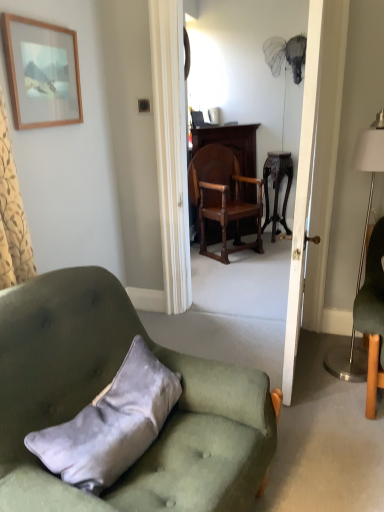
Question: Is white wooden door at center touching polished wood chair at center, which appears as the first chair when viewed from the top?

Choices:
 (A) yes
 (B) no

Answer: (B)

Question: Is white wooden door at center outside polished wood chair at center, the 1th chair viewed from the back?

Choices:
 (A) yes
 (B) no

Answer: (A)

Question: Considering the relative sizes of white wooden door at center and polished wood chair at center, the second chair when ordered from bottom to top, in the image provided, is white wooden door at center bigger than polished wood chair at center, the second chair when ordered from bottom to top,?

Choices:
 (A) yes
 (B) no

Answer: (B)

Question: Could you tell me if white wooden door at center is facing polished wood chair at center, which appears as the first chair when viewed from the top?

Choices:
 (A) yes
 (B) no

Answer: (B)

Question: From the image's perspective, is white wooden door at center above polished wood chair at center, acting as the 2th chair starting from the front?

Choices:
 (A) no
 (B) yes

Answer: (A)

Question: Considering their positions, is dark wood stool at center located in front of or behind velvet gray pillow at lower left?

Choices:
 (A) behind
 (B) front

Answer: (A)

Question: Considering the positions of point (276, 181) and point (99, 466), is point (276, 181) closer or farther from the camera than point (99, 466)?

Choices:
 (A) farther
 (B) closer

Answer: (A)

Question: From the image's perspective, is dark wood stool at center above or below velvet gray pillow at lower left?

Choices:
 (A) above
 (B) below

Answer: (A)

Question: Is dark wood stool at center wider or thinner than velvet gray pillow at lower left?

Choices:
 (A) wide
 (B) thin

Answer: (A)

Question: Which is correct: silver metallic floor lamp at right is inside dark wood stool at center, or outside of it?

Choices:
 (A) inside
 (B) outside

Answer: (B)

Question: Does point (370, 138) appear closer or farther from the camera than point (266, 184)?

Choices:
 (A) closer
 (B) farther

Answer: (A)

Question: Considering the positions of silver metallic floor lamp at right and dark wood stool at center in the image, is silver metallic floor lamp at right taller or shorter than dark wood stool at center?

Choices:
 (A) tall
 (B) short

Answer: (A)

Question: In the image, is silver metallic floor lamp at right on the left side or the right side of dark wood stool at center?

Choices:
 (A) left
 (B) right

Answer: (A)

Question: Does point (297, 230) appear closer or farther from the camera than point (69, 37)?

Choices:
 (A) farther
 (B) closer

Answer: (A)

Question: From the image's perspective, is white wooden door at center above or below wooden picture frame at upper left?

Choices:
 (A) below
 (B) above

Answer: (A)